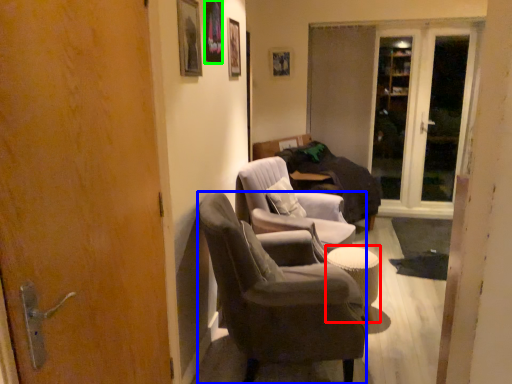
Question: Considering the real-world distances, which object is closest to table (highlighted by a red box)? chair (highlighted by a blue box) or picture frame (highlighted by a green box).

Choices:
 (A) chair
 (B) picture frame

Answer: (A)